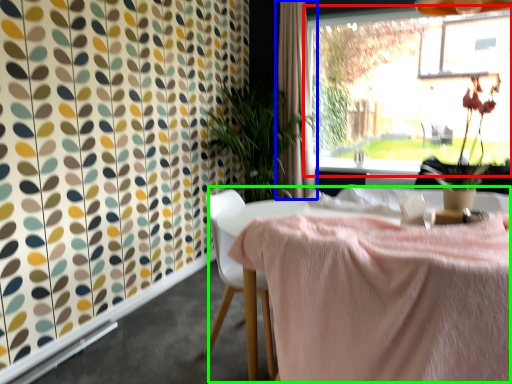
Question: Which object is the closest to the window (highlighted by a red box)? Choose among these: curtain (highlighted by a blue box) or table (highlighted by a green box).

Choices:
 (A) curtain
 (B) table

Answer: (A)